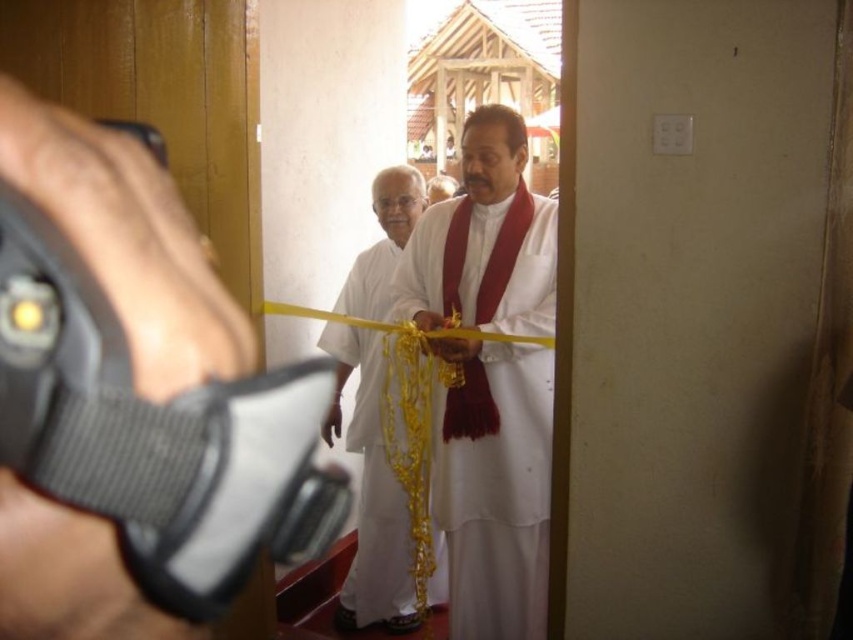
Question: Which point is closer to the camera?

Choices:
 (A) (376, 467)
 (B) (473, 173)

Answer: (B)

Question: Considering the relative positions of white silk dhoti at center and white silk cloth at center in the image provided, where is white silk dhoti at center located with respect to white silk cloth at center?

Choices:
 (A) right
 (B) left

Answer: (A)

Question: Does white silk dhoti at center appear on the right side of white silk cloth at center?

Choices:
 (A) no
 (B) yes

Answer: (B)

Question: Does white silk dhoti at center appear on the right side of white silk cloth at center?

Choices:
 (A) no
 (B) yes

Answer: (B)